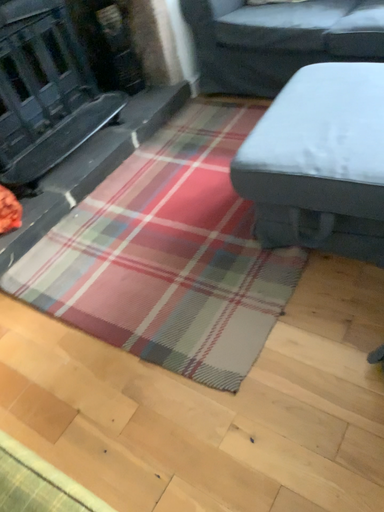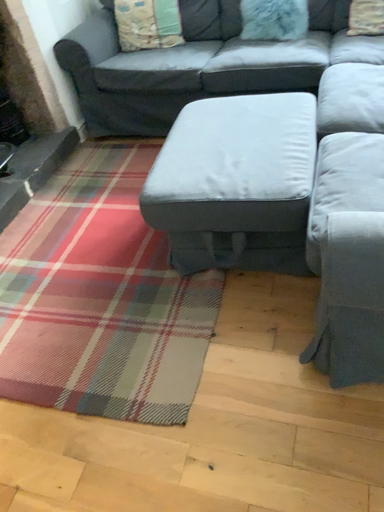
Question: How did the camera likely rotate when shooting the video?

Choices:
 (A) rotated right
 (B) rotated left

Answer: (A)